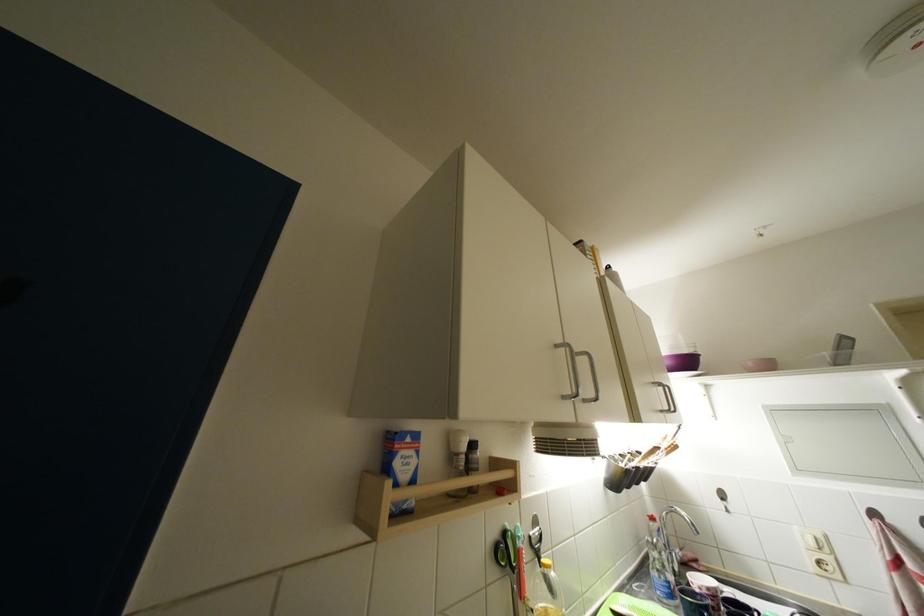
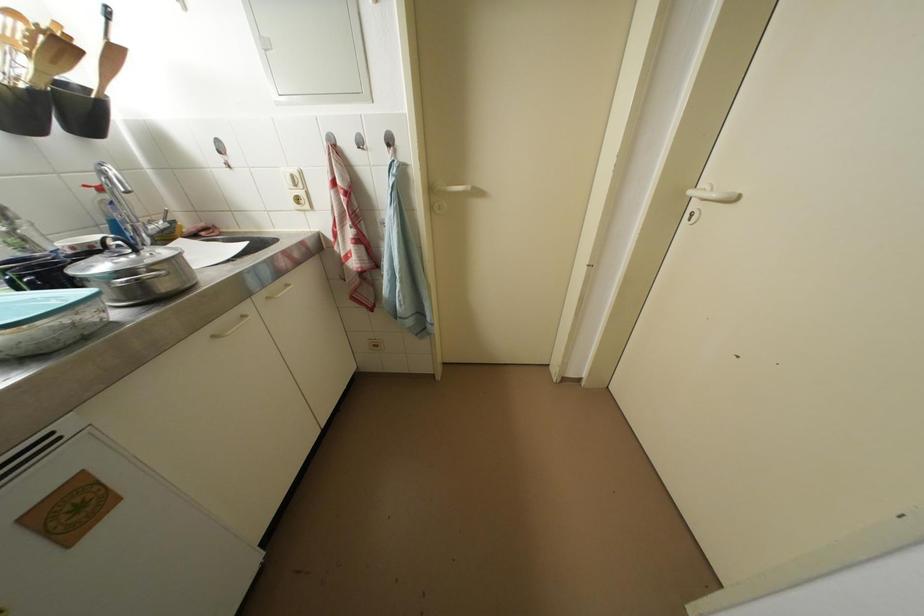
Find the pixel in the second image that matches pixel 681 451 in the first image.

(69, 50)